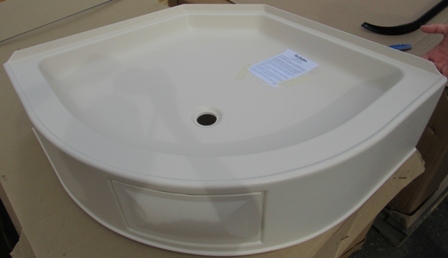
Find the location of a particular element. The width and height of the screenshot is (448, 258). right corner of shower pan is located at coordinates (380, 86).